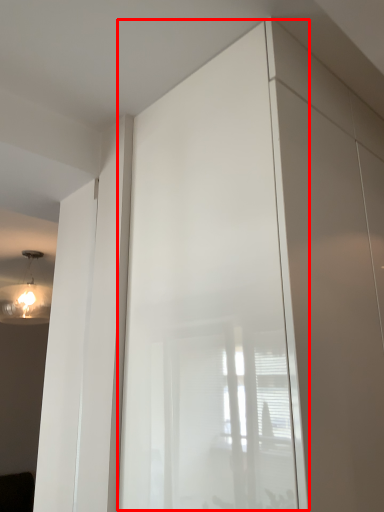
Question: From the image's perspective, what is the correct spatial positioning of screen door (annotated by the red box) in reference to light fixture?

Choices:
 (A) above
 (B) below

Answer: (A)